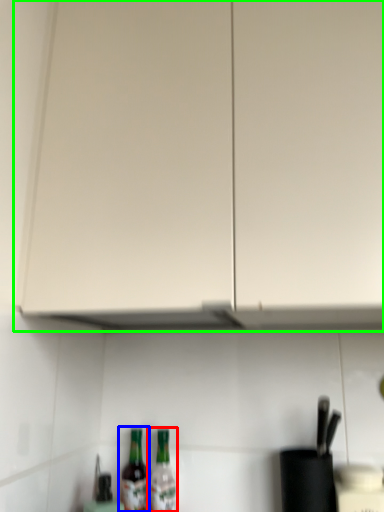
Question: Which object is positioned closest to bottle (highlighted by a red box)? Select from bottle (highlighted by a blue box) and cabinetry (highlighted by a green box).

Choices:
 (A) bottle
 (B) cabinetry

Answer: (A)